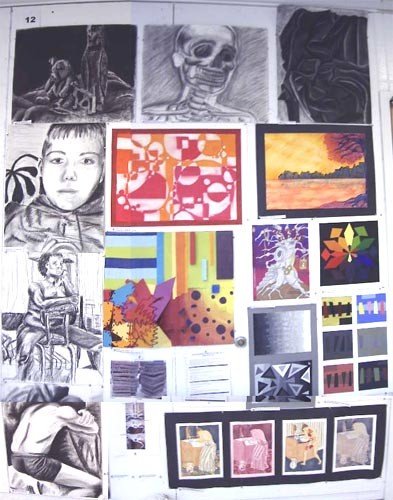
At what (x,y) coordinates should I click in order to perform the action: click on chair. Please return your answer as a coordinate pair (x, y). This screenshot has width=393, height=500. Looking at the image, I should click on (64, 342), (72, 367), (41, 348).